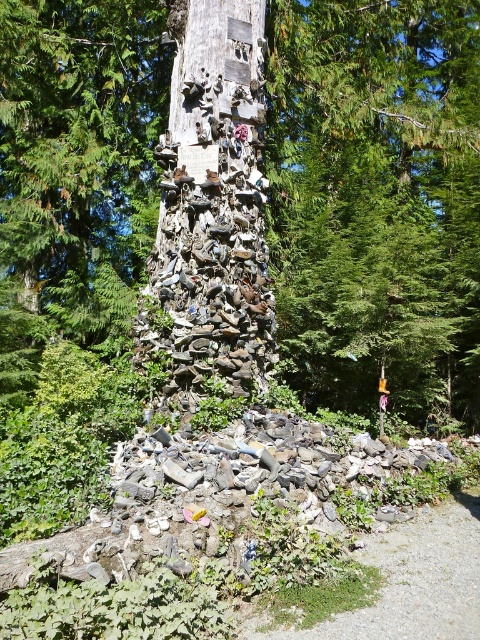
Question: Which point is farther from the camera taking this photo?

Choices:
 (A) (168, 296)
 (B) (372, 104)

Answer: (B)

Question: Does wooden shoe at center have a larger size compared to shiny metallic shoes at center?

Choices:
 (A) no
 (B) yes

Answer: (B)

Question: Does wooden shoe at center have a larger size compared to shiny metallic shoes at center?

Choices:
 (A) yes
 (B) no

Answer: (A)

Question: Where is wooden shoe at center located in relation to shiny metallic shoes at center in the image?

Choices:
 (A) right
 (B) left

Answer: (A)